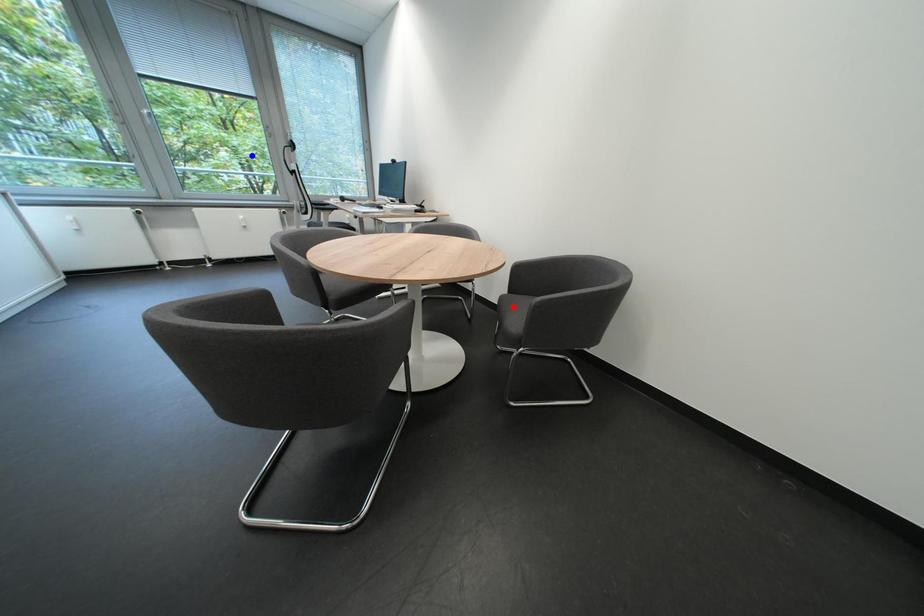
Question: Two points are marked on the image. Which point is closer to the camera?

Choices:
 (A) Blue point is closer.
 (B) Red point is closer.

Answer: (B)